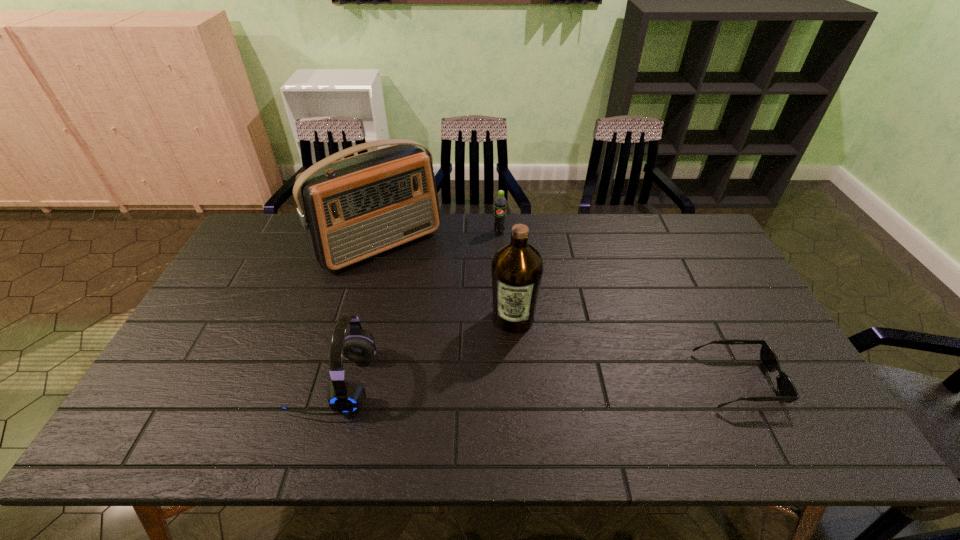
The width and height of the screenshot is (960, 540). Find the location of `headset that is at the near edge`. headset that is at the near edge is located at coordinates (346, 395).

The width and height of the screenshot is (960, 540). Find the location of `sunglasses at the near edge`. sunglasses at the near edge is located at coordinates (788, 393).

The width and height of the screenshot is (960, 540). In order to click on object located at the right edge in this screenshot , I will do `click(788, 393)`.

Where is `object located at the near right corner`? The width and height of the screenshot is (960, 540). object located at the near right corner is located at coordinates (788, 393).

What are the coordinates of `free space at the far edge` in the screenshot? It's located at (618, 245).

Where is `free space at the near edge of the desktop`? This screenshot has height=540, width=960. free space at the near edge of the desktop is located at coordinates (516, 409).

In order to click on vacant space at the left edge of the desktop in this screenshot , I will do `click(199, 355)`.

This screenshot has width=960, height=540. I want to click on vacant region at the right edge of the desktop, so tap(755, 326).

What are the coordinates of `free location at the far right corner` in the screenshot? It's located at click(676, 215).

Find the location of a particular element. free spot between the third tallest object and the radio receiver is located at coordinates (357, 313).